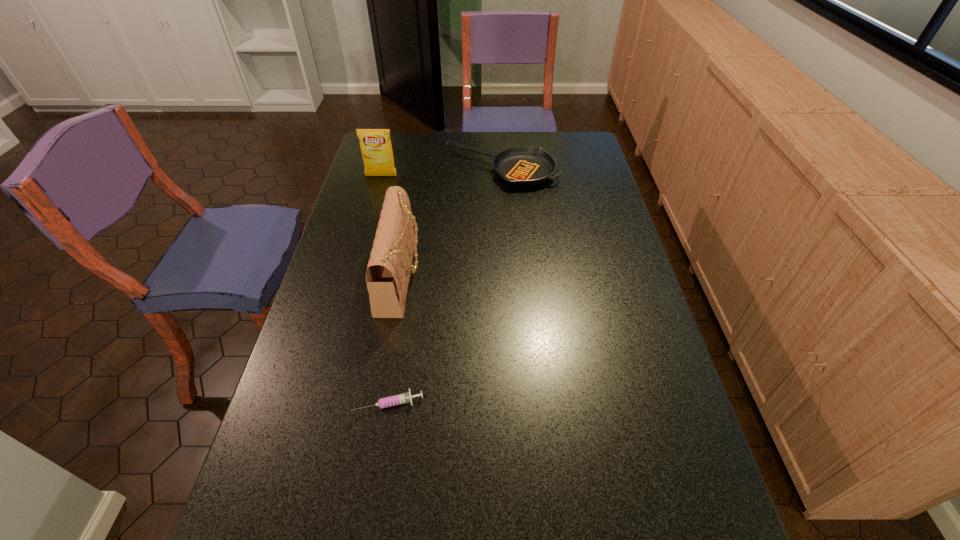
Find the location of a particular element. The image size is (960, 540). object situated at the left edge is located at coordinates [x=376, y=148].

Locate an element on the screen. object that is at the right edge is located at coordinates pos(525,166).

Find the location of a particular element. Image resolution: width=960 pixels, height=540 pixels. object located at the far right corner is located at coordinates (525, 166).

At what (x,y) coordinates should I click in order to perform the action: click on free location at the far edge of the desktop. Please return your answer as a coordinate pair (x, y). Looking at the image, I should click on click(x=540, y=134).

Identify the location of vacant space at the left edge of the desktop. (343, 248).

This screenshot has height=540, width=960. In the image, there is a desktop. Identify the location of vacant space at the right edge. (660, 419).

The width and height of the screenshot is (960, 540). In order to click on free location at the far right corner in this screenshot , I will do `click(584, 137)`.

You are a GUI agent. You are given a task and a screenshot of the screen. Output one action in this format:
    pyautogui.click(x=<x>, y=<y>)
    Task: Click on the free area in between the second nearest object and the third tallest object
    The image size is (960, 540).
    Given the screenshot: What is the action you would take?
    pyautogui.click(x=451, y=222)

Image resolution: width=960 pixels, height=540 pixels. What are the coordinates of `vacant space in between the crisp (potato chip) and the second shortest object` in the screenshot? It's located at (442, 172).

Identify the location of free space between the third farthest object and the third tallest object. This screenshot has height=540, width=960. (451, 222).